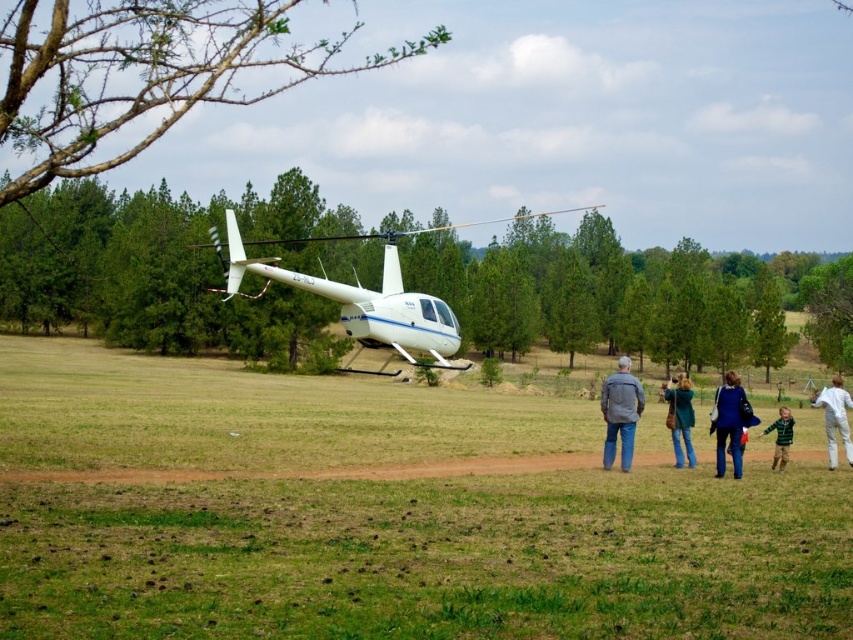
You are a person standing at the edge of the dirt path. You want to walk towards the white cotton pants at lower right while avoiding stepping on the green grass at center. Is this possible?

The green grass at center is shorter than the white cotton pants at lower right. Since the grass is shorter, it is likely lower to the ground, so you can walk around or step over it to reach the white cotton pants at lower right without stepping on the grass.

You are standing at the point labeled point (784, 416) and want to walk to the point labeled point (274, 264). Which direction should you face to walk directly towards your destination?

You should face towards the direction of point (274, 264), which is behind point (784, 416), so you need to walk backwards or turn around to face the opposite direction to reach it directly.